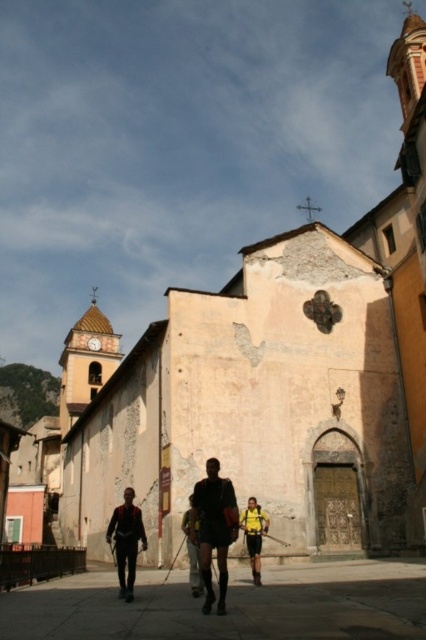
You are a tourist visiting this European town and want to take a photo of the weathered stone church at center. However, there is a dark gray fabric backpack at center blocking your view. Can you estimate whether the backpack is smaller than the church in size?

The weathered stone church at center is bigger than the dark gray fabric backpack at center, so yes, the backpack is smaller and might not fully block the church in the photo.

You are a tourist in the European town and you want to take a photo of the church. You have two items with you, the matte black shorts at center and the yellow fabric backpack at center. Which item is positioned to the left when looking at the church from the front?

The matte black shorts at center are positioned to the left of the yellow fabric backpack at center when looking at the church from the front.